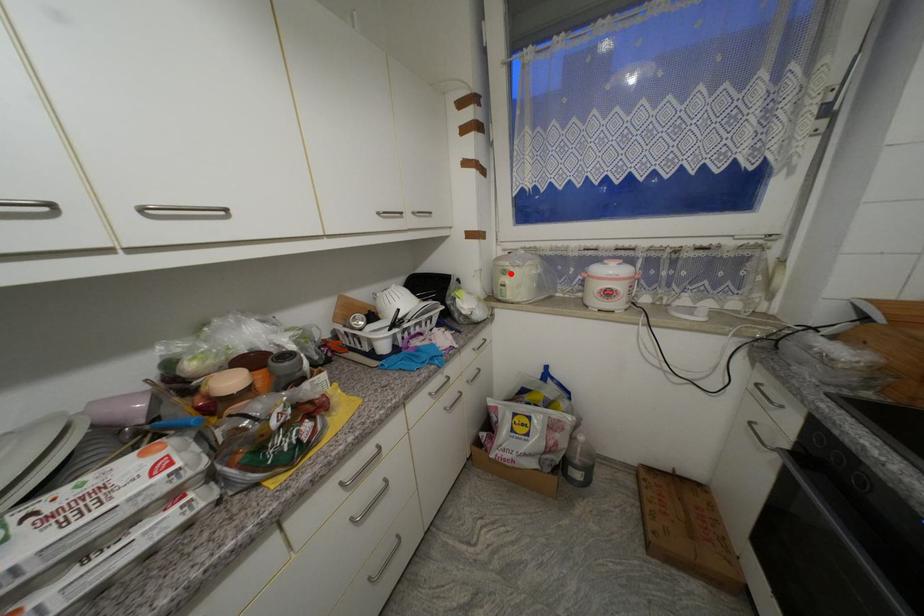
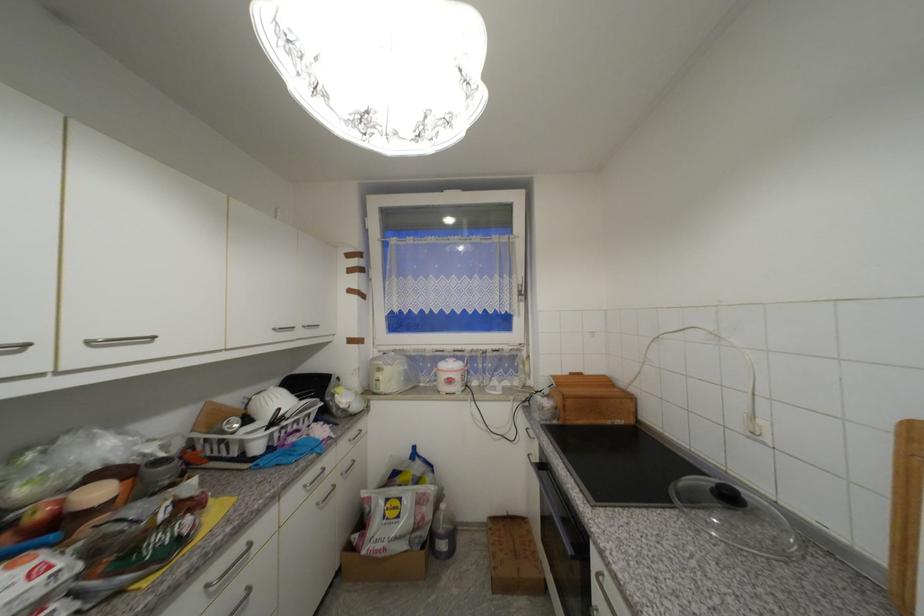
In the second image, find the point that corresponds to the highlighted location in the first image.

(385, 371)